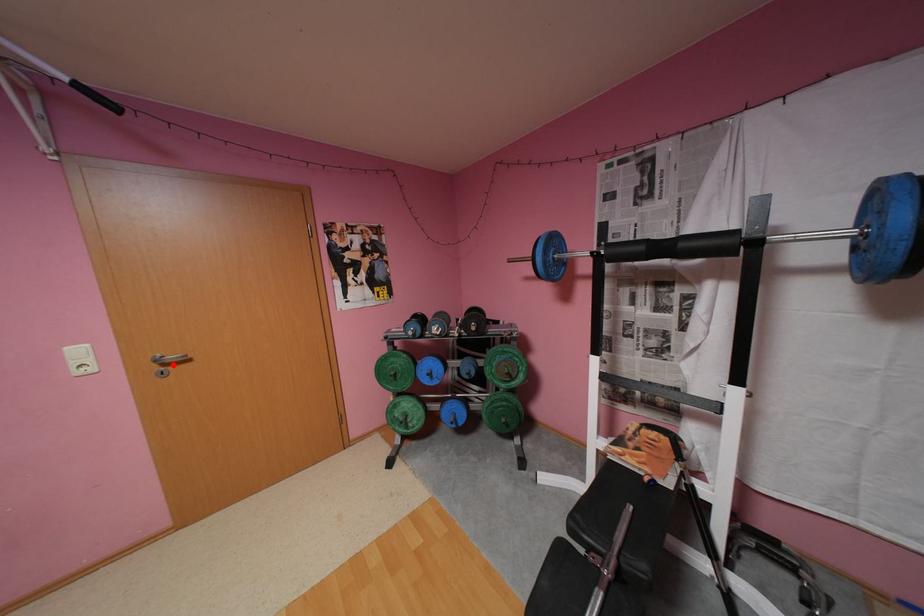
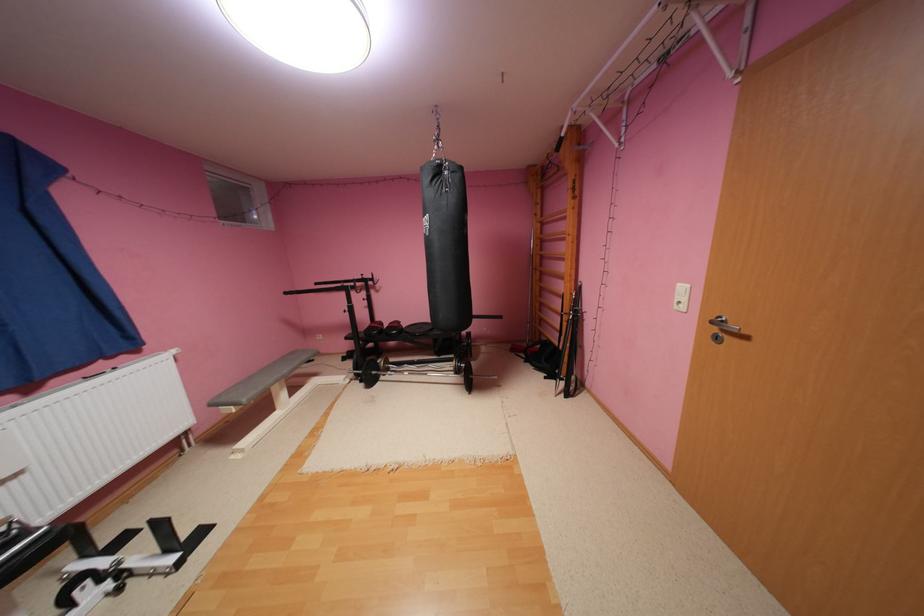
The point at the highlighted location is marked in the first image. Where is the corresponding point in the second image?

(733, 330)